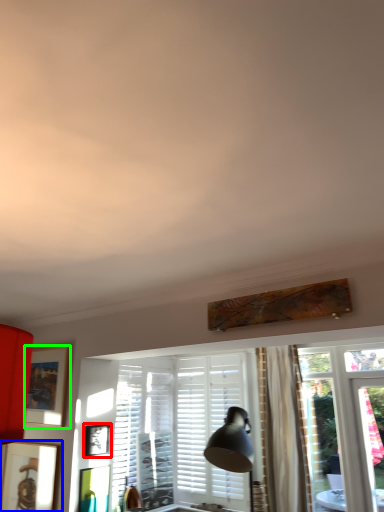
Question: Based on their relative distances, which object is nearer to picture frame (highlighted by a red box)? Choose from picture frame (highlighted by a blue box) and picture frame (highlighted by a green box).

Choices:
 (A) picture frame
 (B) picture frame

Answer: (B)